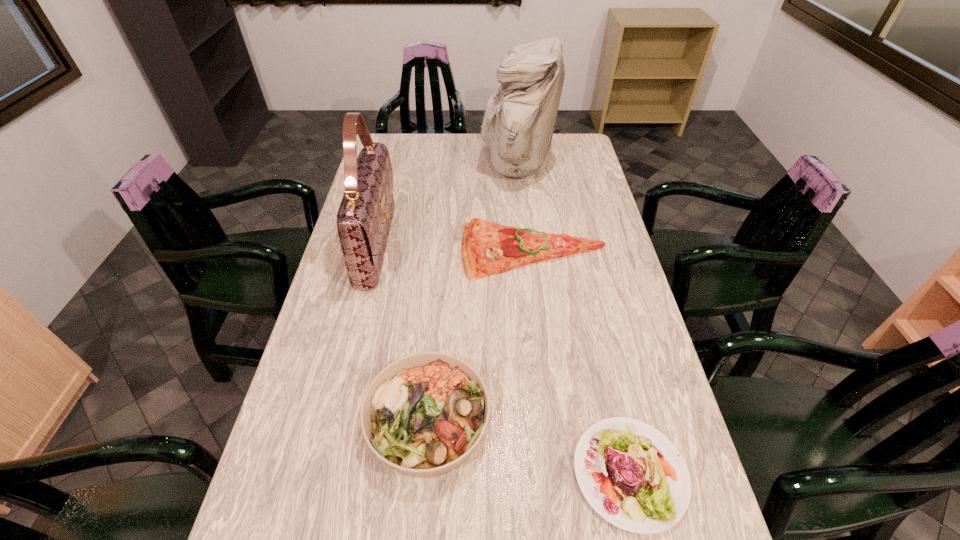
I want to click on free region at the far right corner, so click(564, 136).

You are a GUI agent. You are given a task and a screenshot of the screen. Output one action in this format:
    pyautogui.click(x=<x>, y=<y>)
    Task: Click on the free point between the shorter salad plate and the pizza
    This screenshot has height=540, width=960.
    Given the screenshot: What is the action you would take?
    pyautogui.click(x=582, y=363)

The image size is (960, 540). I want to click on vacant space in between the farthest object and the shorter salad plate, so click(573, 319).

Where is `empty space that is in between the pizza and the taller salad plate`? empty space that is in between the pizza and the taller salad plate is located at coordinates (481, 337).

The image size is (960, 540). In order to click on free space between the right salad plate and the handbag in this screenshot , I will do `click(503, 359)`.

You are a GUI agent. You are given a task and a screenshot of the screen. Output one action in this format:
    pyautogui.click(x=<x>, y=<y>)
    Task: Click on the vacant space in between the backpack and the left salad plate
    The width and height of the screenshot is (960, 540).
    Given the screenshot: What is the action you would take?
    pyautogui.click(x=472, y=294)

Locate an element on the screen. free point between the backpack and the shorter salad plate is located at coordinates (573, 319).

At what (x,y) coordinates should I click in order to perform the action: click on empty space that is in between the leftmost object and the shorter salad plate. Please return your answer as a coordinate pair (x, y). The height and width of the screenshot is (540, 960). Looking at the image, I should click on (503, 359).

This screenshot has width=960, height=540. I want to click on free spot between the farthest object and the pizza, so click(525, 208).

Locate an element on the screen. The height and width of the screenshot is (540, 960). free space between the pizza and the farthest object is located at coordinates (525, 208).